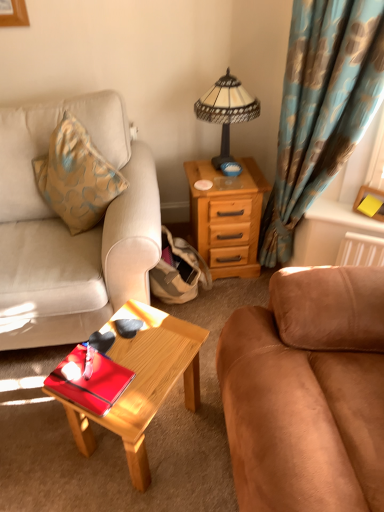
You are a GUI agent. You are given a task and a screenshot of the screen. Output one action in this format:
    pyautogui.click(x=<x>, y=<y>)
    Task: Click on the vacant area that lies to the right of glossy red tray at center
    
    Given the screenshot: What is the action you would take?
    pyautogui.click(x=151, y=371)